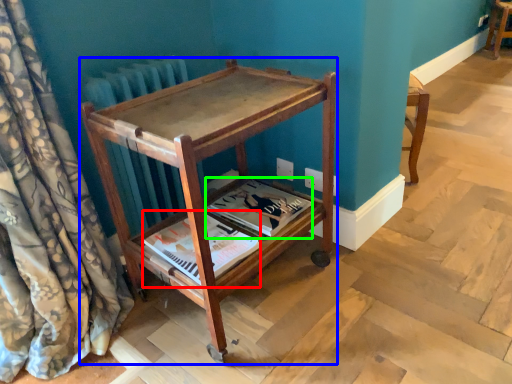
Question: Which is nearer to the magazine (highlighted by a red box)? furniture (highlighted by a blue box) or magazine (highlighted by a green box).

Choices:
 (A) furniture
 (B) magazine

Answer: (B)